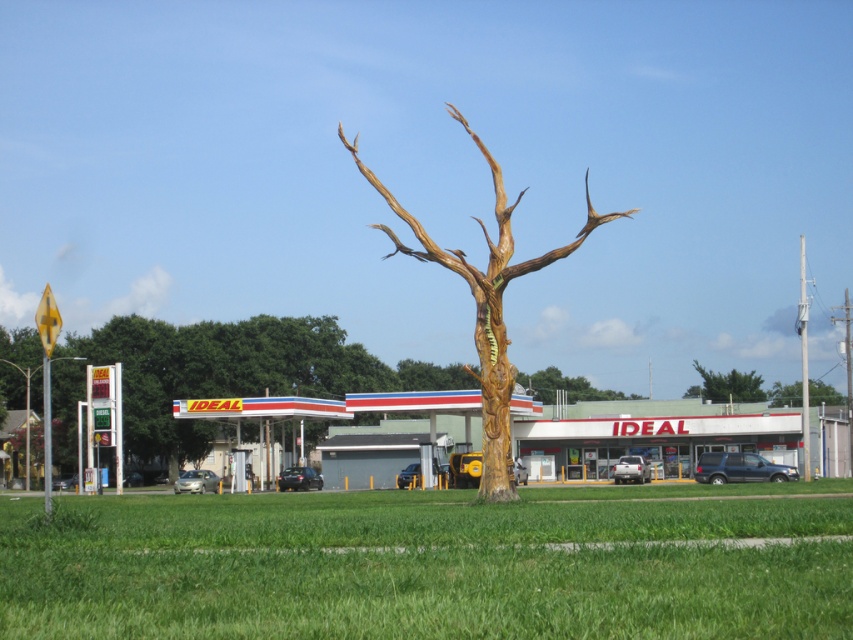
You are driving a car and want to park between the wooden tree trunk at center and the green textured tree at upper center. Is this possible?

The wooden tree trunk at center is in front of the green textured tree at upper center, so there is no space between them for parking.

You are standing in front of the gas station and want to locate two points marked on the ground. The first point is at coordinate point [492,406] and the second is at coordinate point [717,381]. Which point is closer to you?

Point [492,406] is closer to the viewer than point [717,381].

You are a customer at the IDEAL gas station and want to take a photo of the wooden tree trunk at center and the green textured tree at upper center. Which tree should you focus on first if you want to capture both in the same frame without moving your camera?

The wooden tree trunk at center is positioned over the green textured tree at upper center, so you should focus on the wooden tree trunk at center first to ensure both are in the frame without moving the camera.